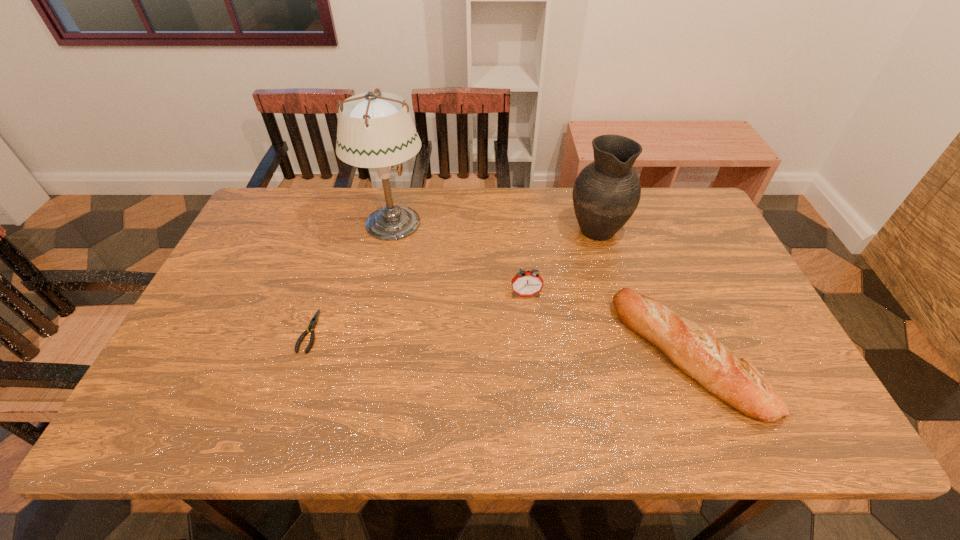
The height and width of the screenshot is (540, 960). I want to click on blank region between the baguet and the pitcher, so click(642, 292).

I want to click on vacant point located between the fourth tallest object and the pliers, so click(x=498, y=343).

The height and width of the screenshot is (540, 960). In order to click on vacant space in between the third object from left to right and the tallest object in this screenshot , I will do `click(459, 259)`.

Locate an element on the screen. free spot between the baguet and the pliers is located at coordinates (498, 343).

Locate an element on the screen. vacant space that's between the lampshade and the pliers is located at coordinates (351, 278).

This screenshot has width=960, height=540. Find the location of `object that is the third closest one to the leftmost object`. object that is the third closest one to the leftmost object is located at coordinates (606, 193).

Find the location of a particular element. Image resolution: width=960 pixels, height=540 pixels. the second closest object to the fourth tallest object is located at coordinates (606, 193).

This screenshot has width=960, height=540. I want to click on free location that satisfies the following two spatial constraints: 1. on the lampshade of the second shortest object; 2. on the right side of the lampshade, so click(365, 355).

At what (x,y) coordinates should I click in order to perform the action: click on free spot that satisfies the following two spatial constraints: 1. on the lampshade of the fourth object from right to left; 2. on the side of the fourth shortest object with the handle. Please return your answer as a coordinate pair (x, y). This screenshot has width=960, height=540. Looking at the image, I should click on (392, 228).